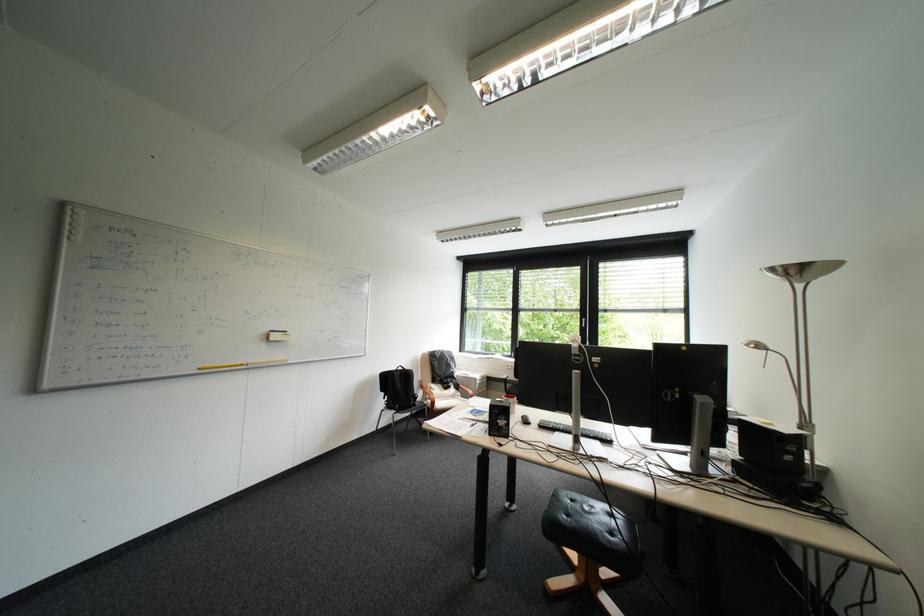
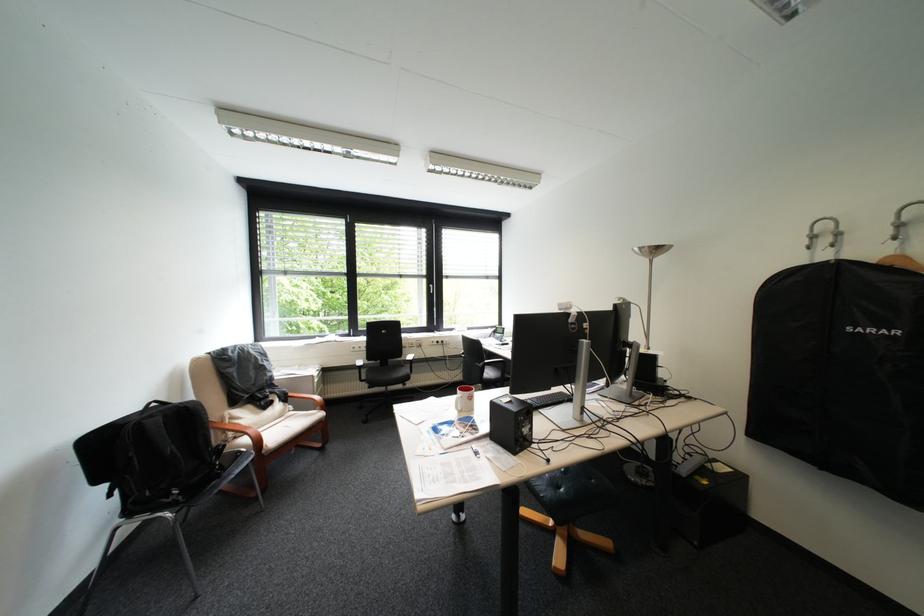
Where in the second image is the point corresponding to point (517, 381) from the first image?

(371, 368)